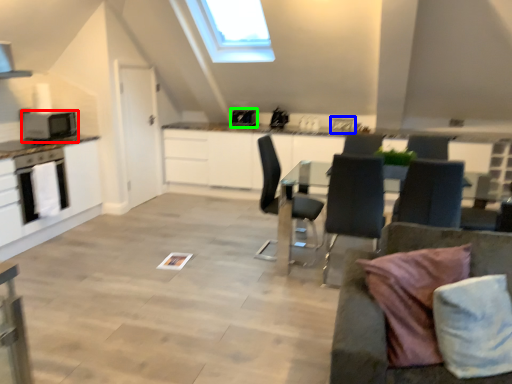
Question: Which is nearer to the appliance (highlighted by a red box)? sink (highlighted by a blue box) or appliance (highlighted by a green box).

Choices:
 (A) sink
 (B) appliance

Answer: (B)